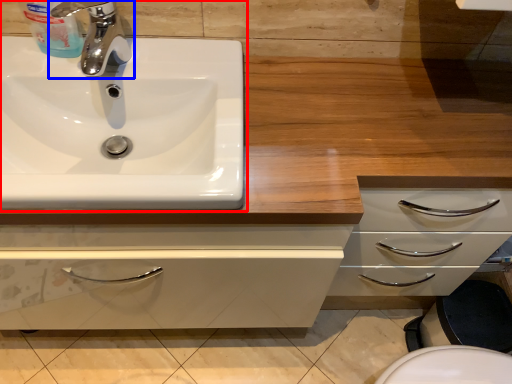
Question: Which point is closer to the camera, sink (highlighted by a red box) or tap (highlighted by a blue box)?

Choices:
 (A) sink
 (B) tap

Answer: (A)